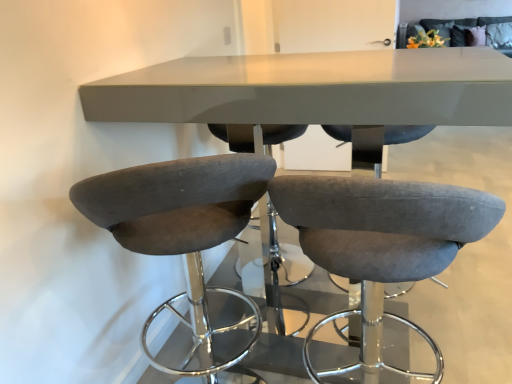
Identify the location of suede-like gray bar stool at left, which appears as the first chair when viewed from the left. Image resolution: width=512 pixels, height=384 pixels. (176, 201).

This screenshot has width=512, height=384. What do you see at coordinates (314, 89) in the screenshot?
I see `matte gray table at center` at bounding box center [314, 89].

Image resolution: width=512 pixels, height=384 pixels. Find the location of `suede-like gray bar stool at left, which appears as the first chair when viewed from the left`. suede-like gray bar stool at left, which appears as the first chair when viewed from the left is located at coordinates (176, 201).

In the scene shown: From the image's perspective, which is above, matte gray table at center or suede-like gray bar stool at left, which is the second chair from right to left?

matte gray table at center.

Which of these two, matte gray table at center or suede-like gray bar stool at left, which is the second chair from right to left, is bigger?

matte gray table at center.

Is matte gray table at center not inside suede-like gray bar stool at left, which appears as the first chair when viewed from the left?

Yes, matte gray table at center is outside of suede-like gray bar stool at left, which appears as the first chair when viewed from the left.

What's the angular difference between matte gray table at center and suede-like gray bar stool at left, which appears as the first chair when viewed from the left,'s facing directions?

The facing directions of matte gray table at center and suede-like gray bar stool at left, which appears as the first chair when viewed from the left, are 90 degrees apart.

Which object is closer to the camera taking this photo, suede gray bar stool at center, the 2th chair from the left, or matte gray table at center?

suede gray bar stool at center, the 2th chair from the left, is closer to the camera.

Is suede gray bar stool at center, the 1th chair viewed from the right, inside the boundaries of matte gray table at center, or outside?

suede gray bar stool at center, the 1th chair viewed from the right, cannot be found inside matte gray table at center.

Is suede gray bar stool at center, the 2th chair from the left, in contact with matte gray table at center?

suede gray bar stool at center, the 2th chair from the left, is not next to matte gray table at center, and they're not touching.

Identify the location of the 2nd chair in front when counting from the matte gray table at center. (382, 226).

Choose the correct answer: Is suede-like gray bar stool at left, which is the second chair from right to left, inside suede gray bar stool at center, the 2th chair from the left, or outside it?

suede-like gray bar stool at left, which is the second chair from right to left, cannot be found inside suede gray bar stool at center, the 2th chair from the left.

Could you tell me if suede-like gray bar stool at left, which appears as the first chair when viewed from the left, is turned towards suede gray bar stool at center, the 1th chair viewed from the right?

No, suede-like gray bar stool at left, which appears as the first chair when viewed from the left, is not facing towards suede gray bar stool at center, the 1th chair viewed from the right.

Identify the location of chair above the suede gray bar stool at center, the 1th chair viewed from the right (from a real-world perspective). (176, 201).

Relative to suede gray bar stool at center, the 1th chair viewed from the right, is suede-like gray bar stool at left, which appears as the first chair when viewed from the left, in front or behind?

In the image, suede-like gray bar stool at left, which appears as the first chair when viewed from the left, appears behind suede gray bar stool at center, the 1th chair viewed from the right.

Visually, is suede-like gray bar stool at left, which appears as the first chair when viewed from the left, positioned to the left or to the right of matte gray table at center?

In the image, suede-like gray bar stool at left, which appears as the first chair when viewed from the left, appears on the left side of matte gray table at center.

Which is closer, (172, 220) or (247, 78)?

The point (172, 220) is more forward.

Could you tell me if suede-like gray bar stool at left, which appears as the first chair when viewed from the left, is turned towards matte gray table at center?

Yes, suede-like gray bar stool at left, which appears as the first chair when viewed from the left, is oriented towards matte gray table at center.

From the image's perspective, between suede-like gray bar stool at left, which is the second chair from right to left, and matte gray table at center, which one is located above?

matte gray table at center.

Does point (466, 74) come behind point (364, 232)?

Yes.

Between matte gray table at center and suede gray bar stool at center, the 2th chair from the left, which one appears on the left side from the viewer's perspective?

From the viewer's perspective, matte gray table at center appears more on the left side.

From a real-world perspective, is matte gray table at center under suede gray bar stool at center, the 2th chair from the left?

Actually, matte gray table at center is physically above suede gray bar stool at center, the 2th chair from the left, in the real world.

This screenshot has width=512, height=384. Find the location of `chair behind the suede gray bar stool at center, the 2th chair from the left`. chair behind the suede gray bar stool at center, the 2th chair from the left is located at coordinates (176, 201).

Considering the positions of point (340, 242) and point (213, 190), is point (340, 242) closer or farther from the camera than point (213, 190)?

Point (340, 242) appears to be farther away from the viewer than point (213, 190).

From the image's perspective, which one is positioned lower, suede gray bar stool at center, the 2th chair from the left, or suede-like gray bar stool at left, which is the second chair from right to left?

suede gray bar stool at center, the 2th chair from the left.

Which of these two, suede gray bar stool at center, the 2th chair from the left, or suede-like gray bar stool at left, which is the second chair from right to left, is smaller?

suede gray bar stool at center, the 2th chair from the left, is smaller.

Locate an element on the screen. The height and width of the screenshot is (384, 512). the 1st chair in front of the matte gray table at center, starting your count from the anchor is located at coordinates (176, 201).

Locate an element on the screen. Image resolution: width=512 pixels, height=384 pixels. chair lying on the right of matte gray table at center is located at coordinates (382, 226).

Which object lies nearer to the anchor point suede gray bar stool at center, the 2th chair from the left, matte gray table at center or suede-like gray bar stool at left, which appears as the first chair when viewed from the left?

Based on the image, suede-like gray bar stool at left, which appears as the first chair when viewed from the left, appears to be nearer to suede gray bar stool at center, the 2th chair from the left.

From the image, which object appears to be nearer to suede-like gray bar stool at left, which appears as the first chair when viewed from the left, suede gray bar stool at center, the 1th chair viewed from the right, or matte gray table at center?

suede gray bar stool at center, the 1th chair viewed from the right, lies closer to suede-like gray bar stool at left, which appears as the first chair when viewed from the left, than the other object.

Estimate the real-world distances between objects in this image. Which object is closer to suede-like gray bar stool at left, which appears as the first chair when viewed from the left, matte gray table at center or suede gray bar stool at center, the 2th chair from the left?

The object closer to suede-like gray bar stool at left, which appears as the first chair when viewed from the left, is suede gray bar stool at center, the 2th chair from the left.

From the image, which object appears to be nearer to matte gray table at center, suede gray bar stool at center, the 1th chair viewed from the right, or suede-like gray bar stool at left, which appears as the first chair when viewed from the left?

Among the two, suede-like gray bar stool at left, which appears as the first chair when viewed from the left, is located nearer to matte gray table at center.

From the picture: Which object lies further to the anchor point suede gray bar stool at center, the 2th chair from the left, suede-like gray bar stool at left, which appears as the first chair when viewed from the left, or matte gray table at center?

Among the two, matte gray table at center is located further to suede gray bar stool at center, the 2th chair from the left.

From the image, which object appears to be nearer to matte gray table at center, suede-like gray bar stool at left, which is the second chair from right to left, or suede gray bar stool at center, the 2th chair from the left?

suede-like gray bar stool at left, which is the second chair from right to left, lies closer to matte gray table at center than the other object.

You are a GUI agent. You are given a task and a screenshot of the screen. Output one action in this format:
    pyautogui.click(x=<x>, y=<y>)
    Task: Click on the table located between suede-like gray bar stool at left, which appears as the first chair when viewed from the left, and suede gray bar stool at center, the 1th chair viewed from the right, in the left-right direction
    The image size is (512, 384).
    Given the screenshot: What is the action you would take?
    pyautogui.click(x=314, y=89)